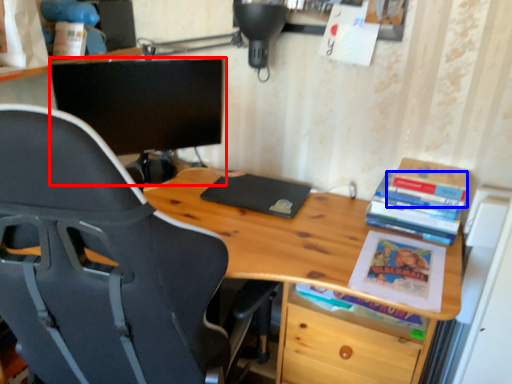
Question: Which object appears closest to the camera in this image, computer monitor (highlighted by a red box) or book (highlighted by a blue box)?

Choices:
 (A) computer monitor
 (B) book

Answer: (B)